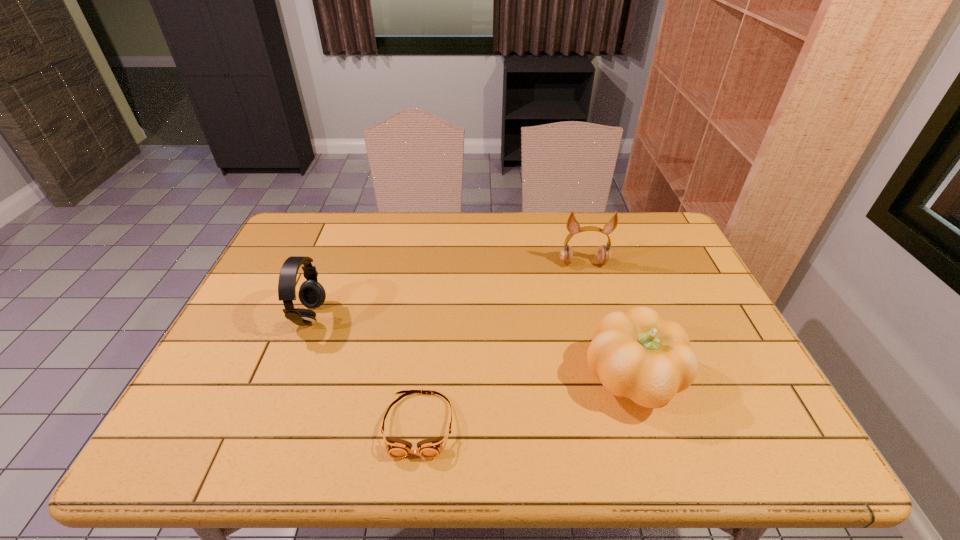
In order to click on vacant area between the pumpkin and the goggles in this screenshot , I will do `click(525, 402)`.

At what (x,y) coordinates should I click in order to perform the action: click on free space that is in between the farthest object and the goggles. Please return your answer as a coordinate pair (x, y). Image resolution: width=960 pixels, height=540 pixels. Looking at the image, I should click on (501, 343).

Locate an element on the screen. This screenshot has width=960, height=540. free space between the leftmost object and the farther earphone is located at coordinates (447, 290).

Find the location of a particular element. vacant space that is in between the pumpkin and the shortest object is located at coordinates click(525, 402).

At what (x,y) coordinates should I click in order to perform the action: click on vacant area that lies between the shortest object and the leftmost object. Please return your answer as a coordinate pair (x, y). The height and width of the screenshot is (540, 960). Looking at the image, I should click on (365, 371).

This screenshot has height=540, width=960. Find the location of `vacant space that is in between the leftmost object and the farthest object`. vacant space that is in between the leftmost object and the farthest object is located at coordinates (447, 290).

Locate an element on the screen. This screenshot has height=540, width=960. free space between the nearer earphone and the pumpkin is located at coordinates (471, 348).

Identify which object is the second nearest to the farthest object. Please provide its 2D coordinates. Your answer should be formatted as a tuple, i.e. [(x, y)], where the tuple contains the x and y coordinates of a point satisfying the conditions above.

[(430, 448)]

Locate an element on the screen. object that is the second closest to the farther earphone is located at coordinates (430, 448).

You are a GUI agent. You are given a task and a screenshot of the screen. Output one action in this format:
    pyautogui.click(x=<x>, y=<y>)
    Task: Click on the blank space that satisfies the following two spatial constraints: 1. on the ear cups of the pumpkin; 2. on the right side of the leftmost object
    
    Given the screenshot: What is the action you would take?
    pyautogui.click(x=285, y=379)